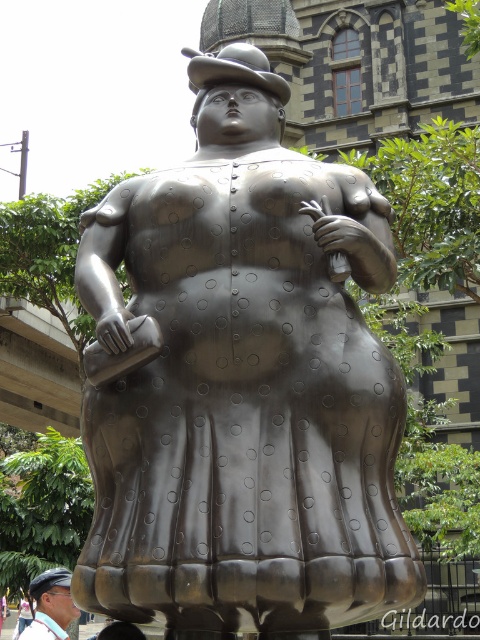
Question: Is bronze/statue at center thinner than matte black hat at lower left?

Choices:
 (A) no
 (B) yes

Answer: (A)

Question: Is bronze/statue at center to the left of matte black hat at lower left from the viewer's perspective?

Choices:
 (A) yes
 (B) no

Answer: (B)

Question: Does bronze/statue at center have a greater width compared to matte black hat at lower left?

Choices:
 (A) yes
 (B) no

Answer: (A)